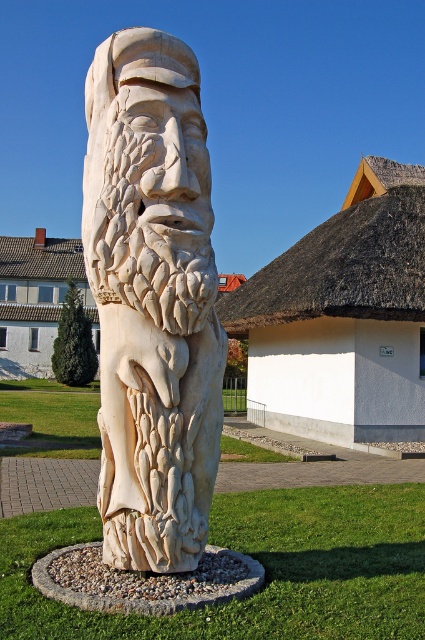
You are an architect analyzing the image. You see the white thatched roof at upper center and the white tiled roof at upper center. Which of these two roofs has a larger surface area?

The white tiled roof at upper center has a larger surface area than the white thatched roof at upper center.

You are standing in front of the wooden sculpture and want to take a photo. There are two points marked on the sculpture, point (x=246, y=330) and point (x=45, y=246). Which point will appear larger in your photo?

Point (x=246, y=330) will appear larger in the photo because it is closer to the camera than point (x=45, y=246).

You are a visitor at an outdoor art exhibition and want to take a photo of the white carved wood statue at center and the white tiled roof at upper center. Which object should you focus on first if you want to capture both in a single frame without moving the camera?

The white carved wood statue at center is shorter than the white tiled roof at upper center, so you should focus on the white carved wood statue at center first to ensure it is in the foreground and the white tiled roof at upper center can be included in the background of the frame.